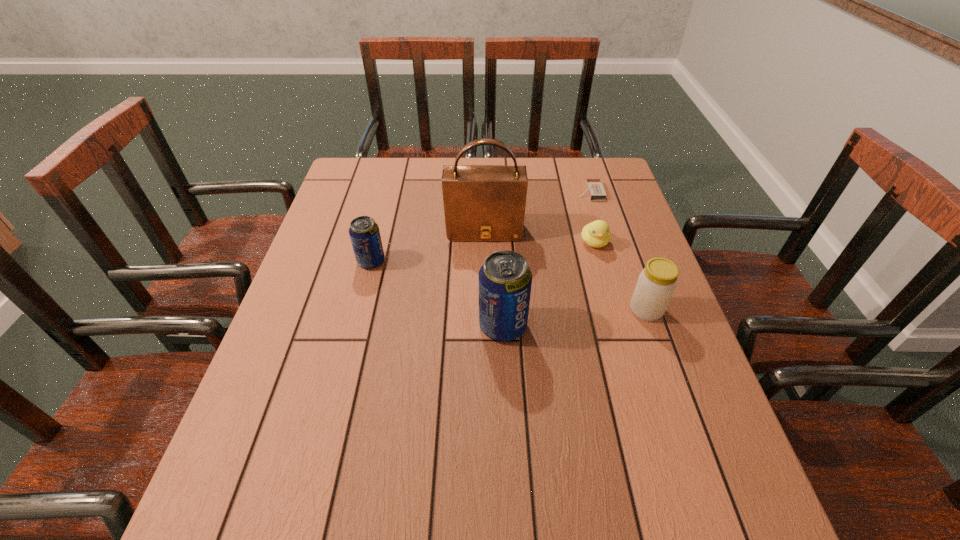
Observe the arrangement of all sodas in the image. To keep them evenly spaced, where would you place another soda on the right? Please locate a free space. Please provide its 2D coordinates. Your answer should be formatted as a tuple, i.e. [(x, y)], where the tuple contains the x and y coordinates of a point satisfying the conditions above.

[(681, 413)]